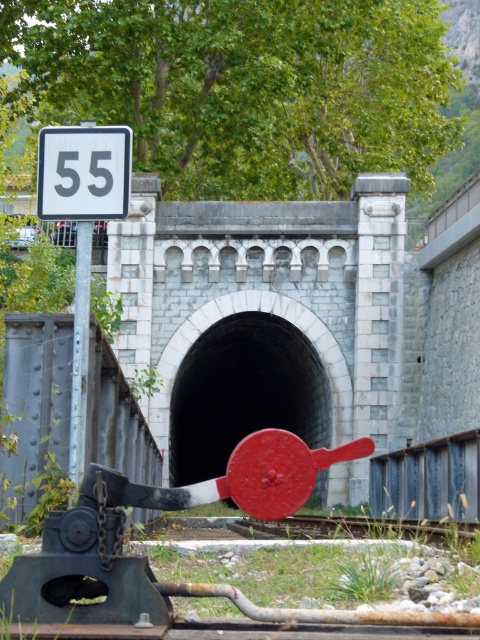
Question: Can you confirm if white plastic sign at left is wider than white plastic speed limit sign at upper left?

Choices:
 (A) no
 (B) yes

Answer: (B)

Question: Which is nearer to the black stone tunnel at center?

Choices:
 (A) metal train track at center
 (B) white plastic sign at left

Answer: (A)

Question: Does white plastic sign at left have a lesser width compared to metallic pole at left?

Choices:
 (A) yes
 (B) no

Answer: (B)

Question: Estimate the real-world distances between objects in this image. Which object is closer to the metal train track at center?

Choices:
 (A) metallic pole at left
 (B) white plastic speed limit sign at upper left
 (C) black stone tunnel at center

Answer: (A)

Question: Which object is the farthest from the black stone tunnel at center?

Choices:
 (A) metal train track at center
 (B) white plastic sign at left
 (C) white plastic speed limit sign at upper left

Answer: (C)

Question: Is black stone tunnel at center positioned at the back of metallic pole at left?

Choices:
 (A) no
 (B) yes

Answer: (B)